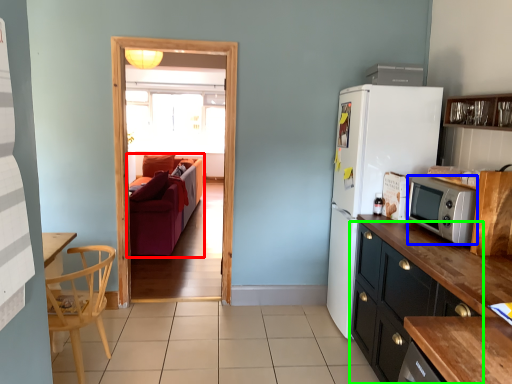
Question: Which object is the closest to the studio couch (highlighted by a red box)? Choose among these: microwave oven (highlighted by a blue box) or cabinetry (highlighted by a green box).

Choices:
 (A) microwave oven
 (B) cabinetry

Answer: (B)